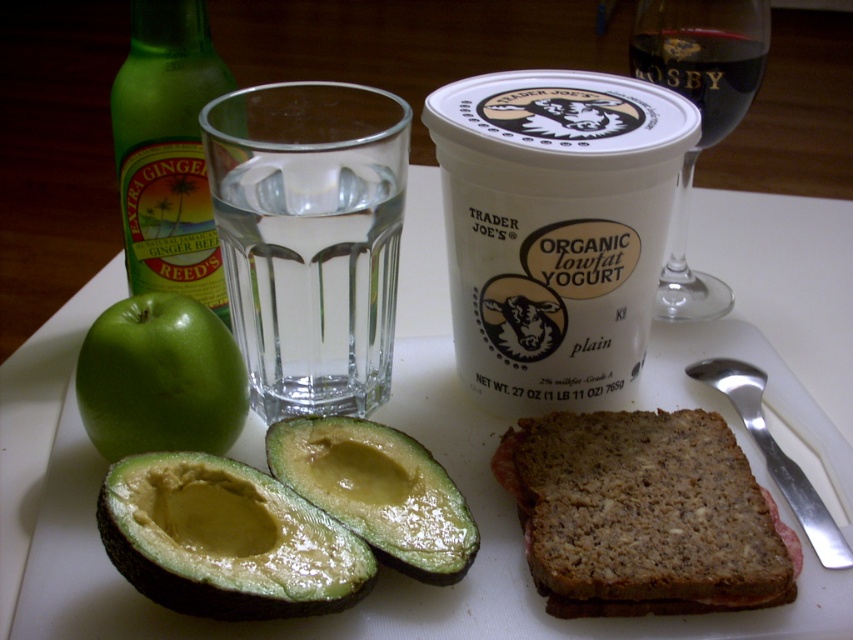
You are a food delivery person who needs to place a small package between the white paper yogurt at upper center and the green glass bottle at upper left. Can you fit it there?

The white paper yogurt at upper center is closer to the viewer than the green glass bottle at upper left, so there is space between them for the small package to fit.

You are a nutritionist analyzing this meal. You need to determine which item is bigger between the white paper yogurt at upper center and the green glass bottle at upper left. Which one is larger?

The white paper yogurt at upper center is larger in size than the green glass bottle at upper left according to the description.

You are a person with a 30 cm long arm. You want to reach the brown grainy bread at lower center from your current position. Can you reach it?

The brown grainy bread at lower center and the viewer are 31.54 centimeters apart. Since your arm is only 30 cm long, you cannot reach it without moving closer.